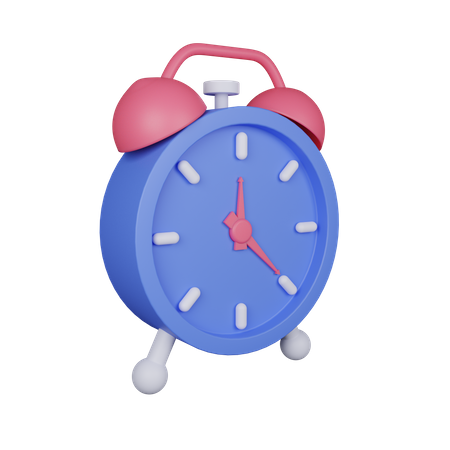
Identify the location of stands. This screenshot has width=450, height=450. (156, 377), (295, 342).